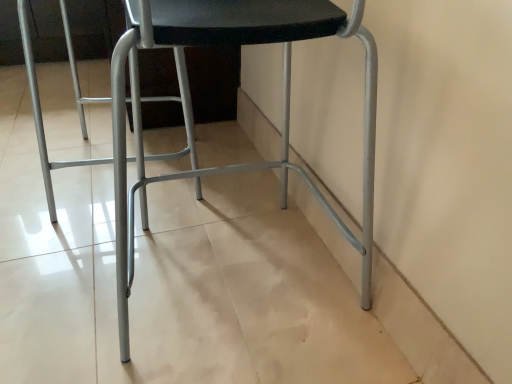
Question: Is metallic gray chair at center inside the boundaries of metallic silver swivel chair at center, or outside?

Choices:
 (A) inside
 (B) outside

Answer: (B)

Question: From a real-world perspective, is metallic gray chair at center positioned above or below metallic silver swivel chair at center?

Choices:
 (A) above
 (B) below

Answer: (A)

Question: Considering the relative positions of metallic gray chair at center and metallic silver swivel chair at center in the image provided, is metallic gray chair at center to the left or to the right of metallic silver swivel chair at center?

Choices:
 (A) right
 (B) left

Answer: (A)

Question: From their relative heights in the image, would you say metallic silver swivel chair at center is taller or shorter than metallic gray chair at center?

Choices:
 (A) tall
 (B) short

Answer: (B)

Question: Is point (49, 195) positioned closer to the camera than point (101, 160)?

Choices:
 (A) closer
 (B) farther

Answer: (A)

Question: From a real-world perspective, is metallic silver swivel chair at center above or below metallic gray chair at center?

Choices:
 (A) above
 (B) below

Answer: (B)

Question: Considering their positions, is metallic silver swivel chair at center located in front of or behind metallic gray chair at center?

Choices:
 (A) behind
 (B) front

Answer: (A)